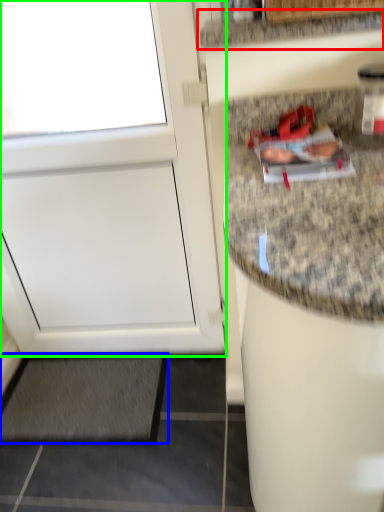
Question: Based on their relative distances, which object is nearer to countertop (highlighted by a red box)? Choose from mat (highlighted by a blue box) and door (highlighted by a green box).

Choices:
 (A) mat
 (B) door

Answer: (B)